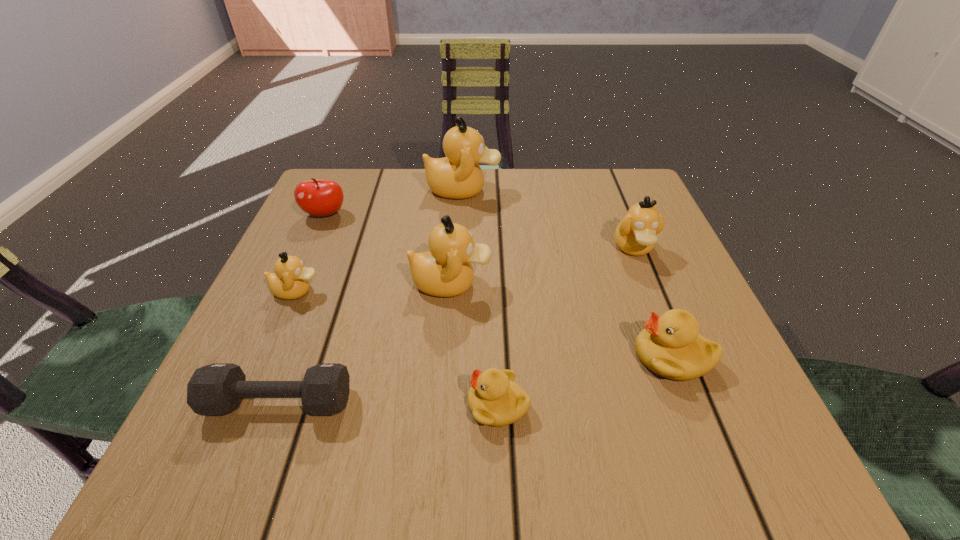
In the image, there is a desktop. Identify the location of free space at the near right corner. (747, 464).

Locate an element on the screen. empty space between the leftmost duckling and the right yellow duckling is located at coordinates (485, 324).

Identify the location of free space between the bigger yellow duckling and the second biggest tan duckling. (562, 320).

Image resolution: width=960 pixels, height=540 pixels. In order to click on unoccupied area between the seventh nearest object and the sixth shortest object in this screenshot , I will do `click(479, 231)`.

This screenshot has width=960, height=540. I want to click on free space between the dumbbell and the seventh nearest object, so click(302, 308).

Find the location of `unoccupied area between the tallest duckling and the dumbbell`. unoccupied area between the tallest duckling and the dumbbell is located at coordinates (372, 296).

The image size is (960, 540). I want to click on free space between the leftmost tan duckling and the right yellow duckling, so click(485, 324).

This screenshot has height=540, width=960. I want to click on unoccupied area between the farthest duckling and the dumbbell, so click(372, 296).

At what (x,y) coordinates should I click in order to perform the action: click on free spot between the bigger yellow duckling and the apple. Please return your answer as a coordinate pair (x, y). This screenshot has width=960, height=540. Looking at the image, I should click on (498, 286).

Locate which object ranks fifth in proximity to the second tallest object. Please provide its 2D coordinates. Your answer should be formatted as a tuple, i.e. [(x, y)], where the tuple contains the x and y coordinates of a point satisfying the conditions above.

[(315, 197)]